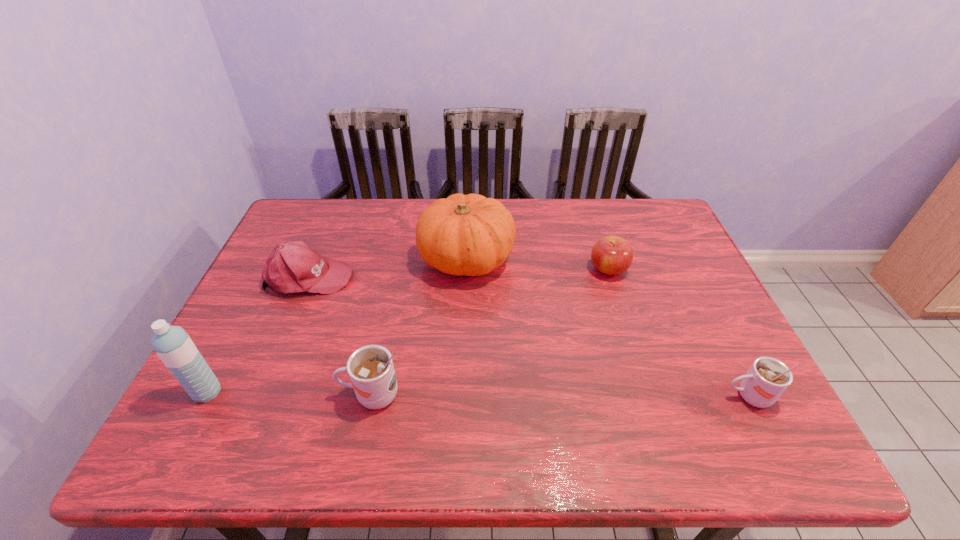
If equal spacing is the goal by inserting an additional cup among them, please point out a vacant space for this new cup. Please provide its 2D coordinates. Your answer should be formatted as a tuple, i.e. [(x, y)], where the tuple contains the x and y coordinates of a point satisfying the conditions above.

[(560, 395)]